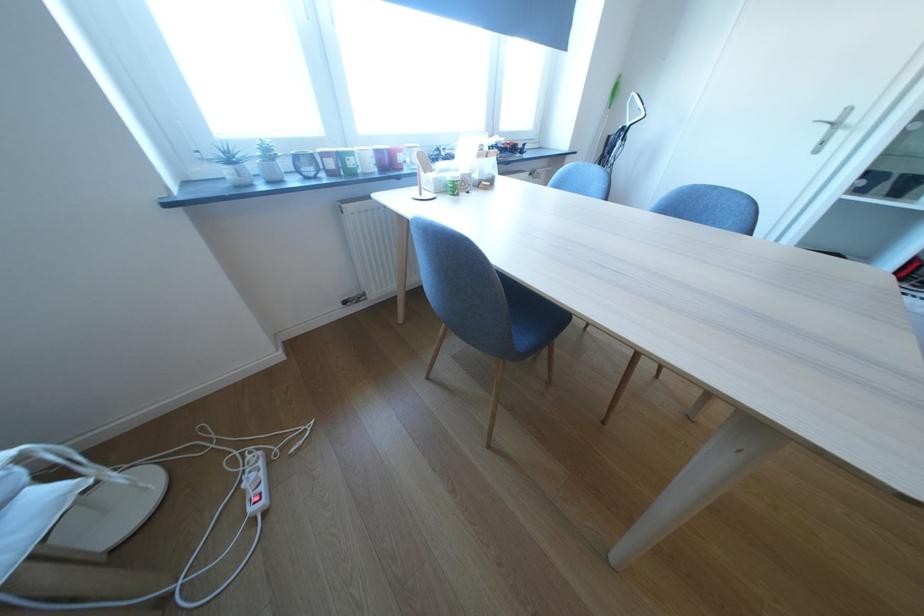
Which object does [347,161] point to?

It corresponds to the green candle jar in the image.